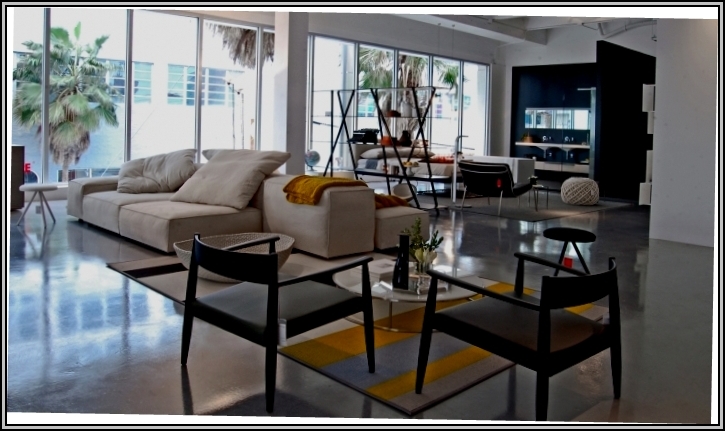
Locate an element on the screen. The image size is (725, 431). couches is located at coordinates (175, 196), (317, 201).